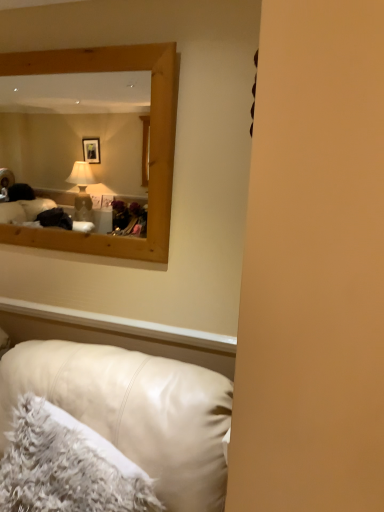
Question: Is point (8, 357) closer or farther from the camera than point (13, 430)?

Choices:
 (A) farther
 (B) closer

Answer: (A)

Question: Is leather couch at lower left in front of or behind white fluffy pillow at lower left in the image?

Choices:
 (A) behind
 (B) front

Answer: (B)

Question: Considering the positions of leather couch at lower left and white fluffy pillow at lower left in the image, is leather couch at lower left wider or thinner than white fluffy pillow at lower left?

Choices:
 (A) wide
 (B) thin

Answer: (A)

Question: In terms of width, does white fluffy pillow at lower left look wider or thinner when compared to leather couch at lower left?

Choices:
 (A) wide
 (B) thin

Answer: (B)

Question: From the image's perspective, is white fluffy pillow at lower left positioned above or below leather couch at lower left?

Choices:
 (A) above
 (B) below

Answer: (A)

Question: Do you think white fluffy pillow at lower left is within leather couch at lower left, or outside of it?

Choices:
 (A) inside
 (B) outside

Answer: (A)

Question: From a real-world perspective, is white fluffy pillow at lower left positioned above or below leather couch at lower left?

Choices:
 (A) above
 (B) below

Answer: (A)